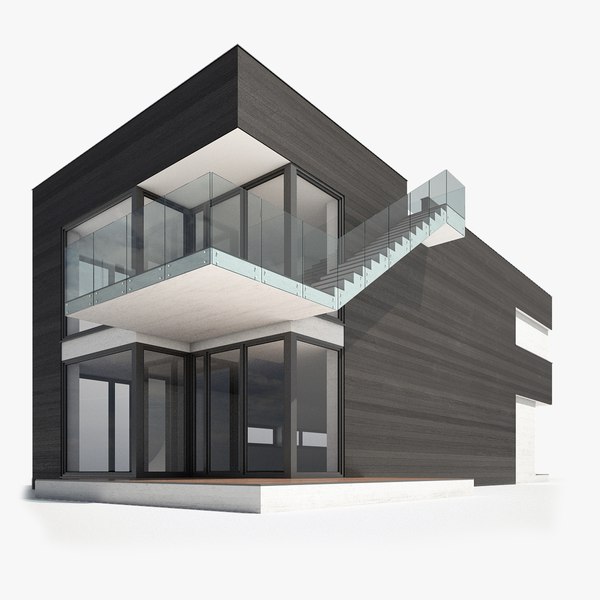
The image size is (600, 600). I want to click on ceiling, so click(x=238, y=154).